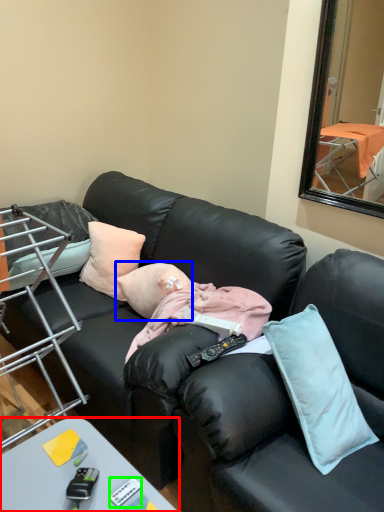
Question: Which object is positioned closest to desk (highlighted by a red box)? Select from person (highlighted by a blue box) and remote control (highlighted by a green box).

Choices:
 (A) person
 (B) remote control

Answer: (B)